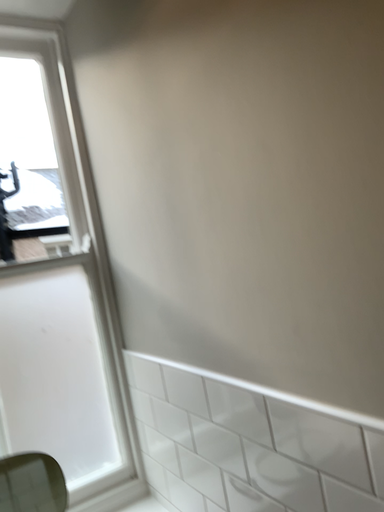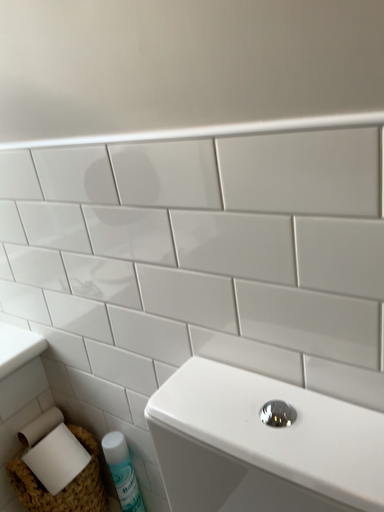
Question: Which way did the camera rotate in the video?

Choices:
 (A) rotated upward
 (B) rotated downward

Answer: (B)